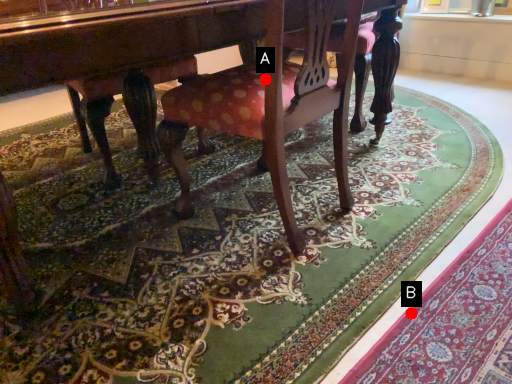
Question: Two points are circled on the image, labeled by A and B beside each circle. Which point is closer to the camera taking this photo?

Choices:
 (A) A is closer
 (B) B is closer

Answer: (B)